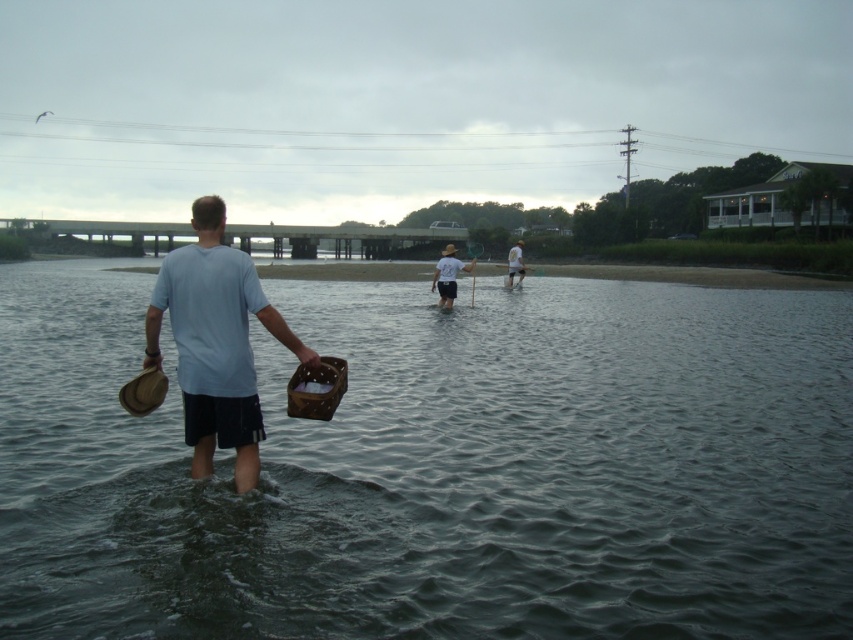
Image resolution: width=853 pixels, height=640 pixels. Describe the element at coordinates (438, 467) in the screenshot. I see `clear water at center` at that location.

Is clear water at center wider than white matte shirt at center?

Correct, the width of clear water at center exceeds that of white matte shirt at center.

At what (x,y) coordinates should I click in order to perform the action: click on clear water at center. Please return your answer as a coordinate pair (x, y). The height and width of the screenshot is (640, 853). Looking at the image, I should click on (438, 467).

Who is more distant from viewer, (x=251, y=262) or (x=450, y=266)?

Positioned behind is point (x=450, y=266).

Can you confirm if light blue cotton shirt at center is bigger than white matte shirt at center?

No, light blue cotton shirt at center is not bigger than white matte shirt at center.

You are a GUI agent. You are given a task and a screenshot of the screen. Output one action in this format:
    pyautogui.click(x=<x>, y=<y>)
    Task: Click on the light blue cotton shirt at center
    The height and width of the screenshot is (640, 853).
    Given the screenshot: What is the action you would take?
    pyautogui.click(x=215, y=342)

Where is `light blue cotton shirt at center`? light blue cotton shirt at center is located at coordinates (215, 342).

Does white matte shirt at center appear on the right side of white cotton shirt at center?

In fact, white matte shirt at center is to the left of white cotton shirt at center.

Can you confirm if white matte shirt at center is taller than white cotton shirt at center?

No, white matte shirt at center is not taller than white cotton shirt at center.

Does point (431, 288) lie in front of point (520, 273)?

That is True.

In order to click on white matte shirt at center in this screenshot , I will do `click(448, 275)`.